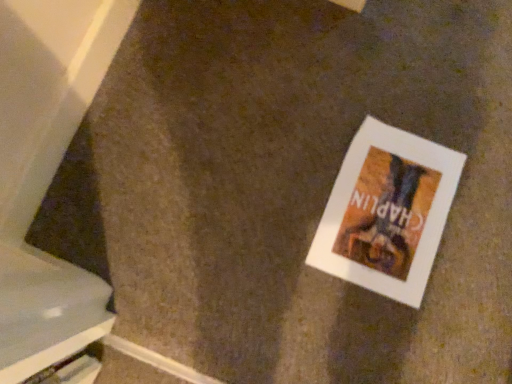
This screenshot has width=512, height=384. Describe the element at coordinates (387, 212) in the screenshot. I see `white paper at center` at that location.

You are a GUI agent. You are given a task and a screenshot of the screen. Output one action in this format:
    pyautogui.click(x=<x>, y=<y>)
    Task: Click on the white paper at center
    The width and height of the screenshot is (512, 384).
    Given the screenshot: What is the action you would take?
    pyautogui.click(x=387, y=212)

You are a GUI agent. You are given a task and a screenshot of the screen. Output one action in this format:
    pyautogui.click(x=<x>, y=<y>)
    Task: Click on the white paper at center
    The height and width of the screenshot is (384, 512).
    Given the screenshot: What is the action you would take?
    pyautogui.click(x=387, y=212)